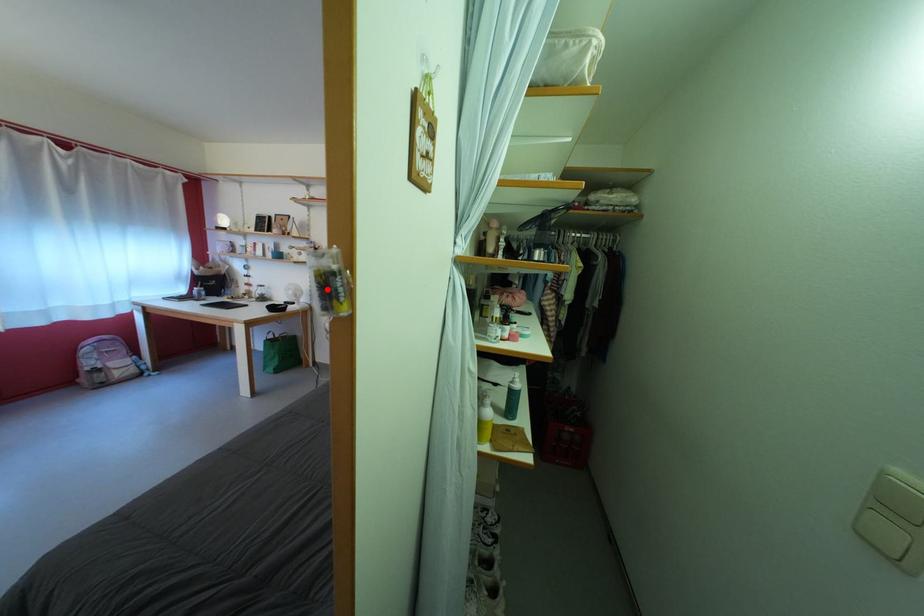
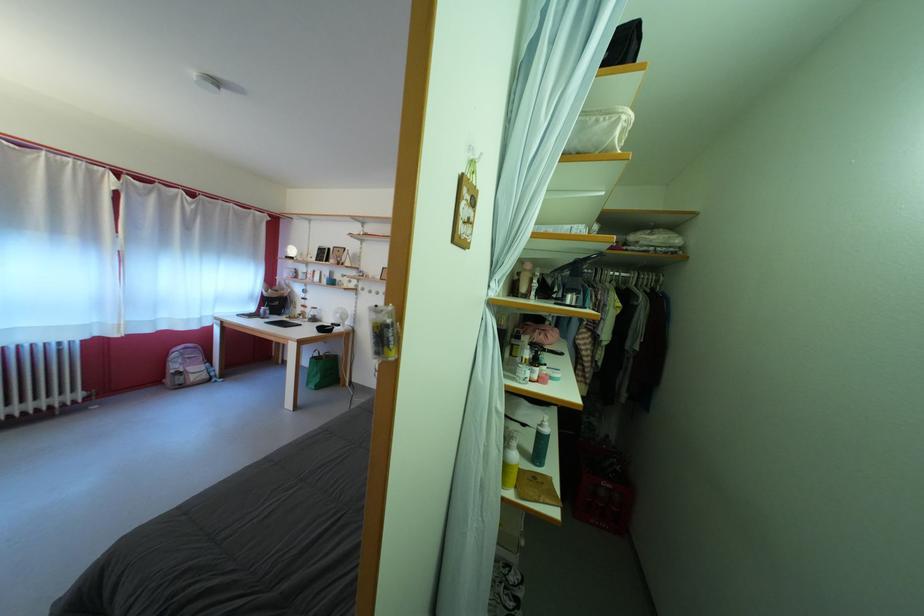
The point at the highlighted location is marked in the first image. Where is the corresponding point in the second image?

(383, 339)